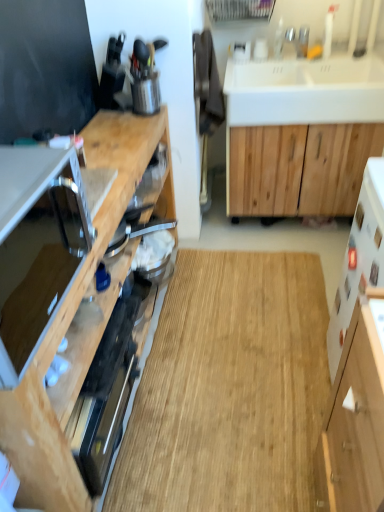
Locate an element on the screen. vacant region above wooden cabinet at left, acting as the 3th cabinetry starting from the right (from a real-world perspective) is located at coordinates (113, 155).